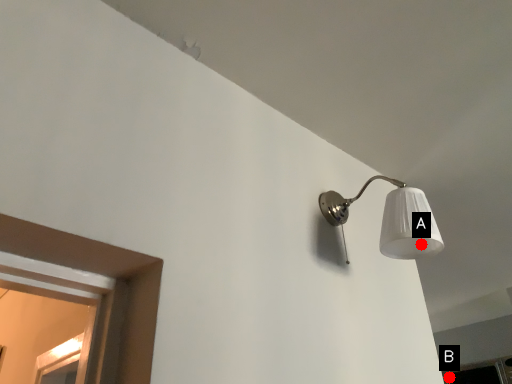
Question: Two points are circled on the image, labeled by A and B beside each circle. Among these points, which one is farthest from the camera?

Choices:
 (A) A is further
 (B) B is further

Answer: (B)